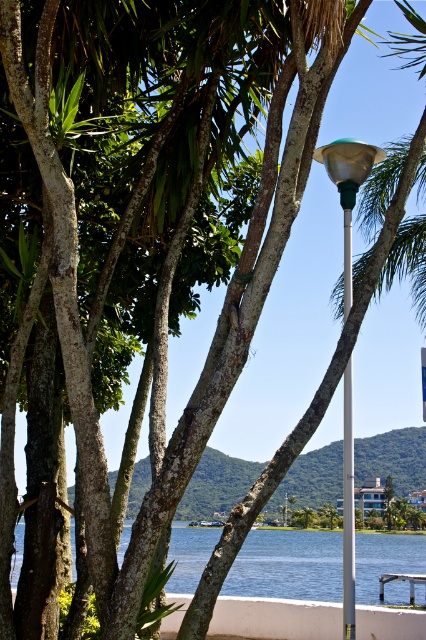
Who is higher up, green plastic lamp post at upper center or white plastic sign at upper center?

Positioned higher is green plastic lamp post at upper center.

Measure the distance from green plastic lamp post at upper center to white plastic sign at upper center.

They are 1.87 meters apart.

You are a GUI agent. You are given a task and a screenshot of the screen. Output one action in this format:
    pyautogui.click(x=<x>, y=<y>)
    Task: Click on the green plastic lamp post at upper center
    
    Given the screenshot: What is the action you would take?
    pyautogui.click(x=348, y=188)

The image size is (426, 640). Find the location of `green plastic lamp post at upper center`. green plastic lamp post at upper center is located at coordinates (348, 188).

Between point (207, 557) and point (422, 394), which one is positioned behind?

Point (207, 557)

Does blue water at lower center appear under white plastic sign at upper center?

Correct, blue water at lower center is located below white plastic sign at upper center.

Does point (302, 570) lie in front of point (423, 356)?

No.

This screenshot has height=640, width=426. Identify the location of blue water at lower center. (287, 564).

Does green plastic pole at center appear under wooden park bench at lower right?

No.

Is green plastic pole at center positioned before wooden park bench at lower right?

Yes.

This screenshot has width=426, height=640. What are the coordinates of `green plastic pole at center` in the screenshot? It's located at (348, 509).